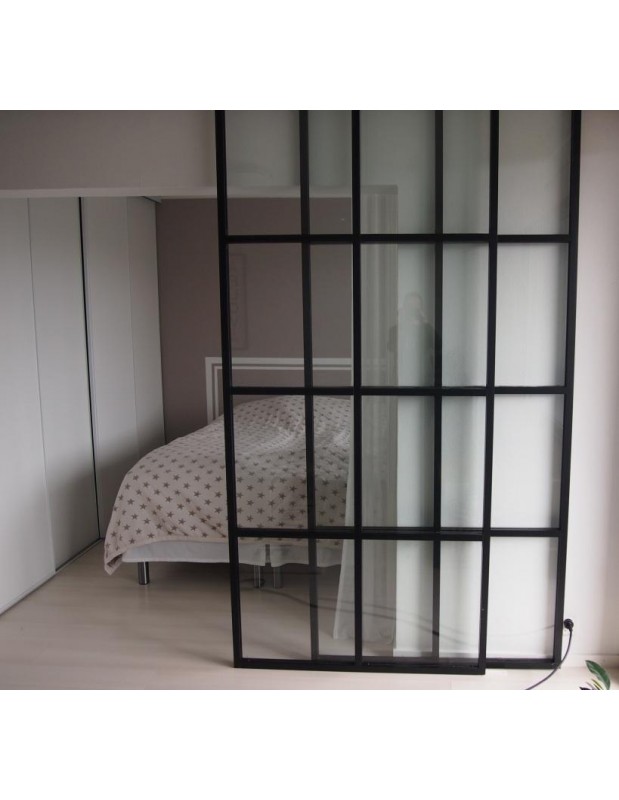
The image size is (619, 800). In order to click on wardrobe door in this screenshot , I will do `click(111, 366)`, `click(150, 366)`, `click(65, 429)`, `click(31, 490)`.